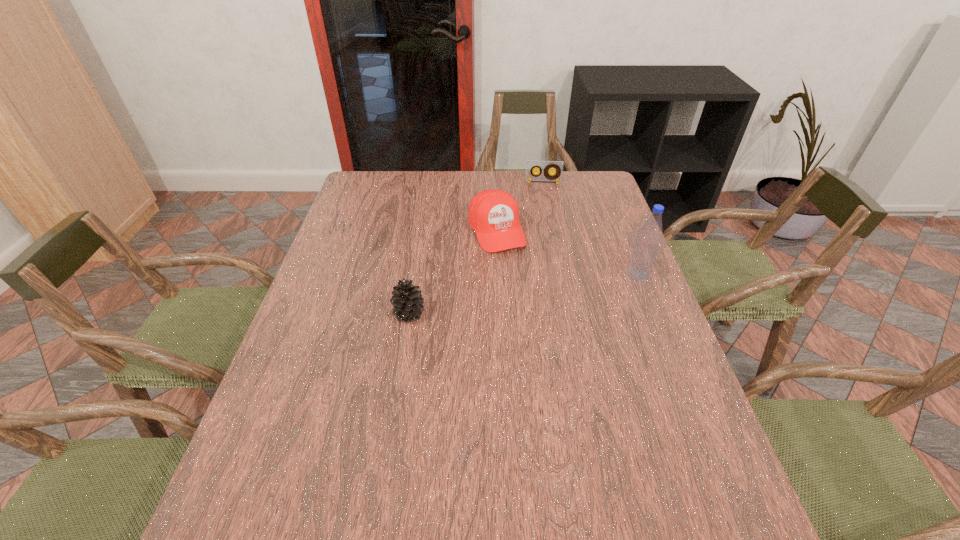
Identify the location of free space at the far edge of the desktop. The width and height of the screenshot is (960, 540). (525, 200).

I want to click on vacant area at the near edge, so click(x=372, y=469).

The height and width of the screenshot is (540, 960). I want to click on free space at the left edge of the desktop, so click(269, 404).

Where is `vacant space that's between the water bottle and the shortest object`? This screenshot has width=960, height=540. vacant space that's between the water bottle and the shortest object is located at coordinates (590, 228).

The image size is (960, 540). What are the coordinates of `free space between the baseball cap and the second object from right to left` in the screenshot? It's located at (519, 207).

Where is `empty space that is in between the third object from left to right and the third nearest object`? Image resolution: width=960 pixels, height=540 pixels. empty space that is in between the third object from left to right and the third nearest object is located at coordinates (519, 207).

Where is `unoccupied position between the videotape and the baseball cap`? unoccupied position between the videotape and the baseball cap is located at coordinates (519, 207).

At what (x,y) coordinates should I click in order to perform the action: click on free space between the third object from right to left and the water bottle. Please return your answer as a coordinate pair (x, y). The height and width of the screenshot is (540, 960). Looking at the image, I should click on (567, 252).

Find the location of a particular element. free space between the leftmost object and the second nearest object is located at coordinates (524, 294).

Locate an element on the screen. The image size is (960, 540). vacant space that is in between the third nearest object and the pinecone is located at coordinates click(x=453, y=272).